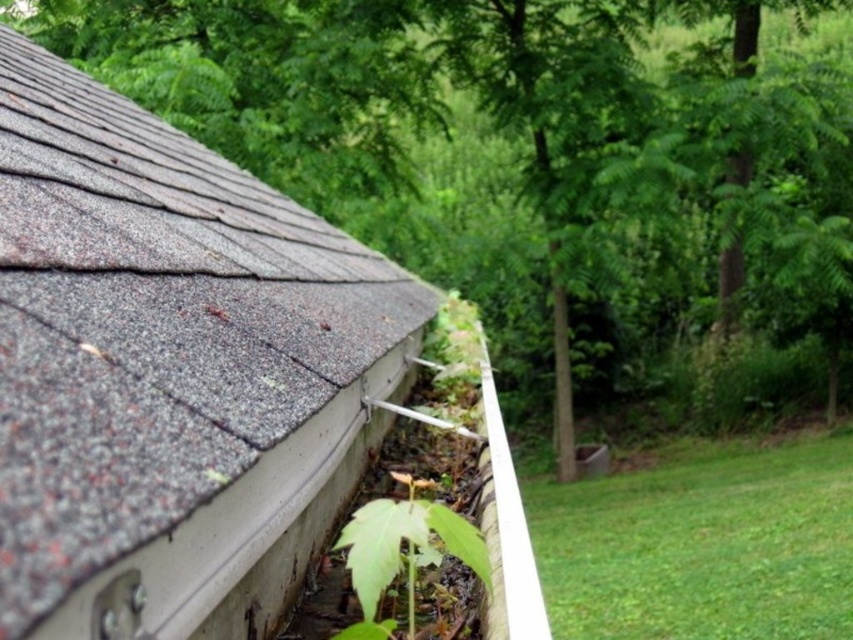
You are a contractor assessing the roof damage. You see a point at coordinates (170, 369). What is located at that point?

At point (170, 369) lies gray shingles at upper left.

You are a roofer assessing the roof and gutter system. You notice the gray shingles at upper left and the green leafy plant at lower center. Which object is wider in the image?

The gray shingles at upper left might be wider than green leafy plant at lower center according to the description.

You are a gardener looking at the roof and gutter system. You notice the gray shingles at upper left and the green leafy plant at lower center. Which object is positioned to the left of the other?

The gray shingles at upper left is to the left of green leafy plant at lower center.